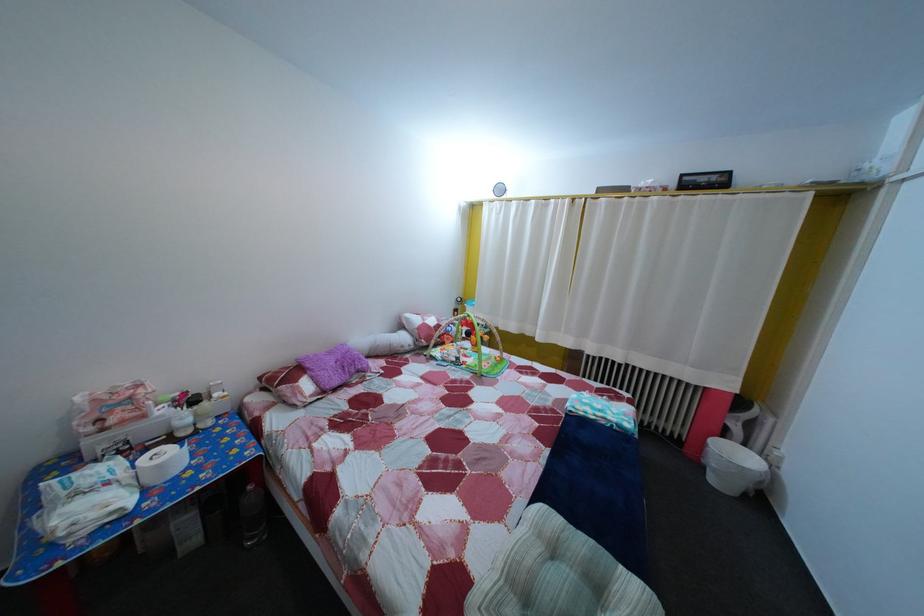
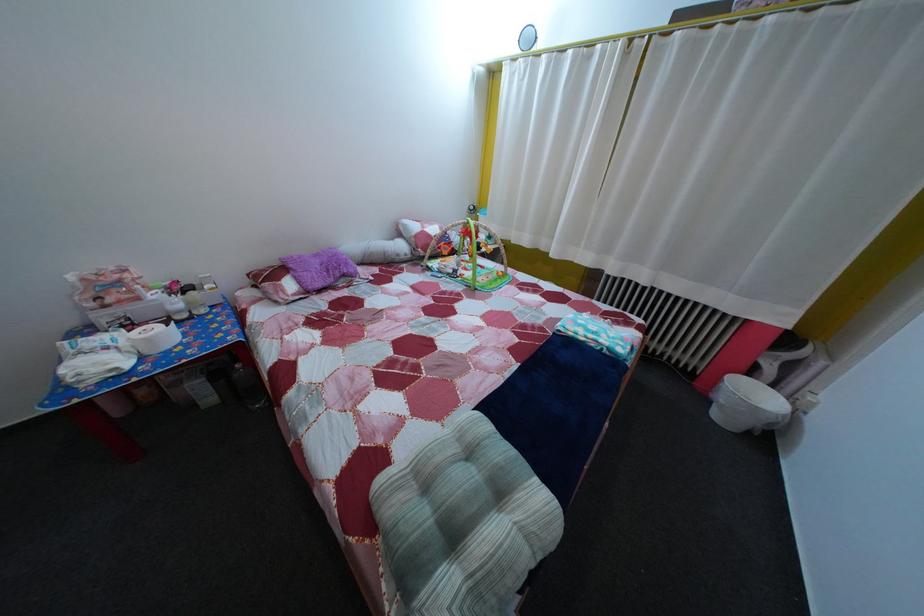
The point at (339, 361) is marked in the first image. Where is the corresponding point in the second image?

(325, 262)